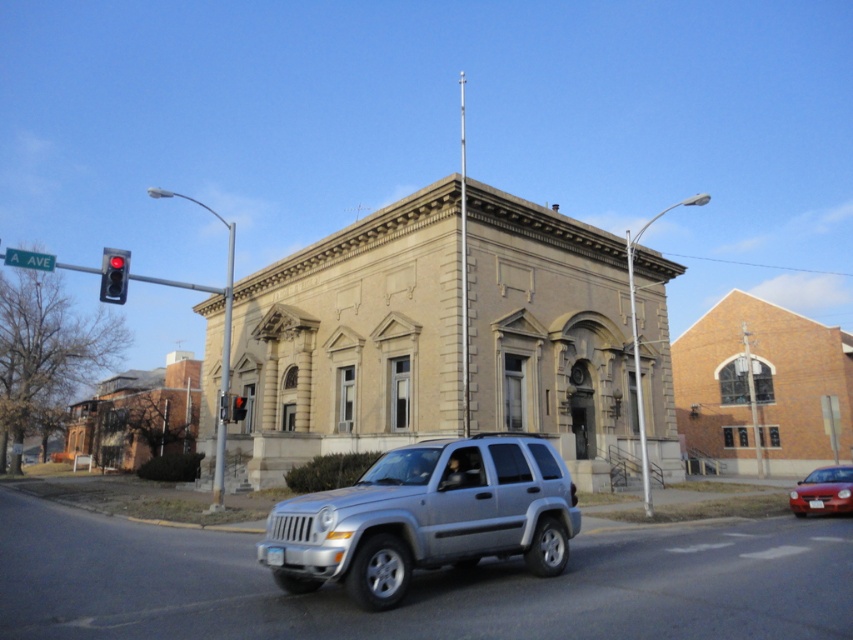
Does satin silver suv at center have a lesser height compared to shiny red sedan at lower right?

Indeed, satin silver suv at center has a lesser height compared to shiny red sedan at lower right.

Does satin silver suv at center appear on the left side of shiny red sedan at lower right?

Correct, you'll find satin silver suv at center to the left of shiny red sedan at lower right.

Is point (352, 502) farther from camera compared to point (824, 474)?

No, it is not.

Where is `satin silver suv at center`? satin silver suv at center is located at coordinates (426, 516).

Which is in front, point (814, 493) or point (234, 403)?

Point (814, 493) is more forward.

Does shiny red sedan at lower right have a greater height compared to red glass traffic light at upper left?

Correct, shiny red sedan at lower right is much taller as red glass traffic light at upper left.

This screenshot has height=640, width=853. What do you see at coordinates (822, 492) in the screenshot?
I see `shiny red sedan at lower right` at bounding box center [822, 492].

Locate an element on the screen. The width and height of the screenshot is (853, 640). shiny red sedan at lower right is located at coordinates (822, 492).

Which is in front, point (549, 518) or point (109, 285)?

Point (549, 518) is in front.

Can you confirm if satin silver suv at center is bigger than red glass traffic light at left?

No, satin silver suv at center is not bigger than red glass traffic light at left.

This screenshot has width=853, height=640. In order to click on satin silver suv at center in this screenshot , I will do `click(426, 516)`.